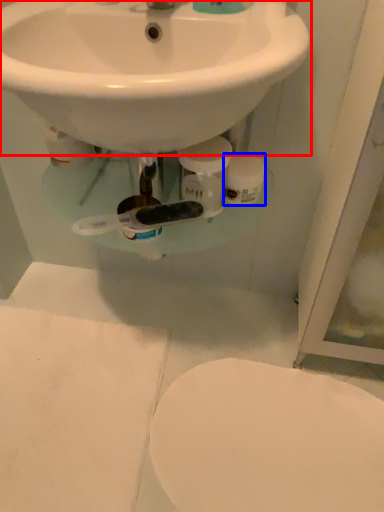
Question: Among these objects, which one is nearest to the camera, sink (highlighted by a red box) or toilet paper (highlighted by a blue box)?

Choices:
 (A) sink
 (B) toilet paper

Answer: (A)